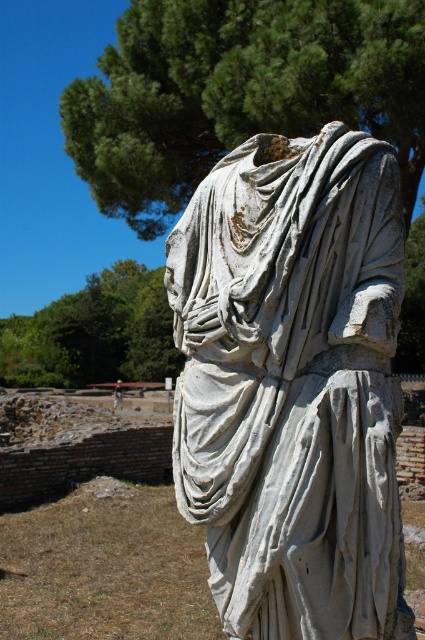
Who is higher up, white marble statue at center or green leafy tree at upper center?

green leafy tree at upper center is above.

Between point (206, 195) and point (192, 172), which one is positioned behind?

Positioned behind is point (192, 172).

Does point (317, 360) come farther from viewer compared to point (421, 156)?

No, (317, 360) is in front of (421, 156).

Locate an element on the screen. The image size is (425, 640). white marble statue at center is located at coordinates (291, 384).

Is green leafy tree at upper center above green leafy tree at upper left?

Yes, green leafy tree at upper center is above green leafy tree at upper left.

In the scene shown: Who is positioned more to the left, green leafy tree at upper center or green leafy tree at upper left?

From the viewer's perspective, green leafy tree at upper left appears more on the left side.

Identify the location of green leafy tree at upper center. (238, 92).

Between point (243, 225) and point (93, 276), which one is positioned in front?

Point (243, 225) is in front.

Does white marble statue at center come in front of green leafy tree at upper left?

That is True.

You are a GUI agent. You are given a task and a screenshot of the screen. Output one action in this format:
    pyautogui.click(x=<x>, y=<y>)
    Task: Click on the white marble statue at center
    
    Given the screenshot: What is the action you would take?
    pyautogui.click(x=291, y=384)